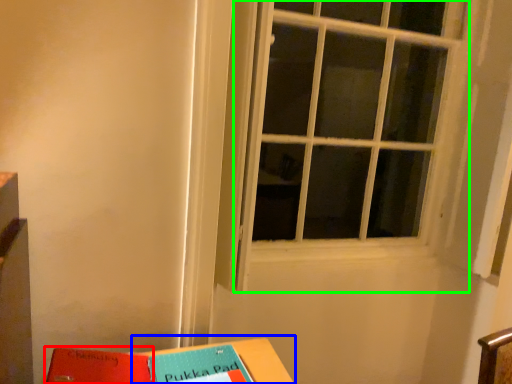
Question: Considering the real-world distances, which object is farthest from paperback book (highlighted by a red box)? table (highlighted by a blue box) or window (highlighted by a green box)?

Choices:
 (A) table
 (B) window

Answer: (B)